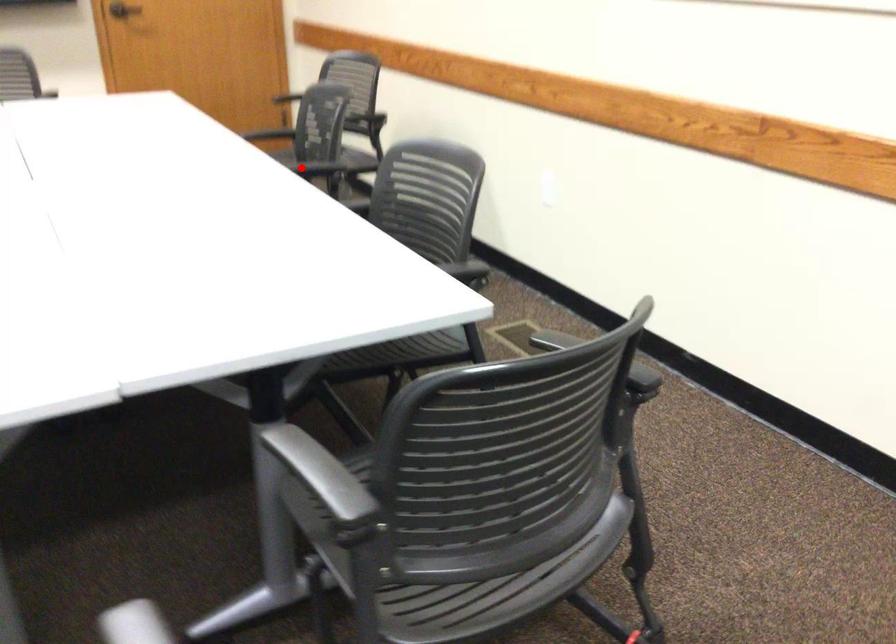
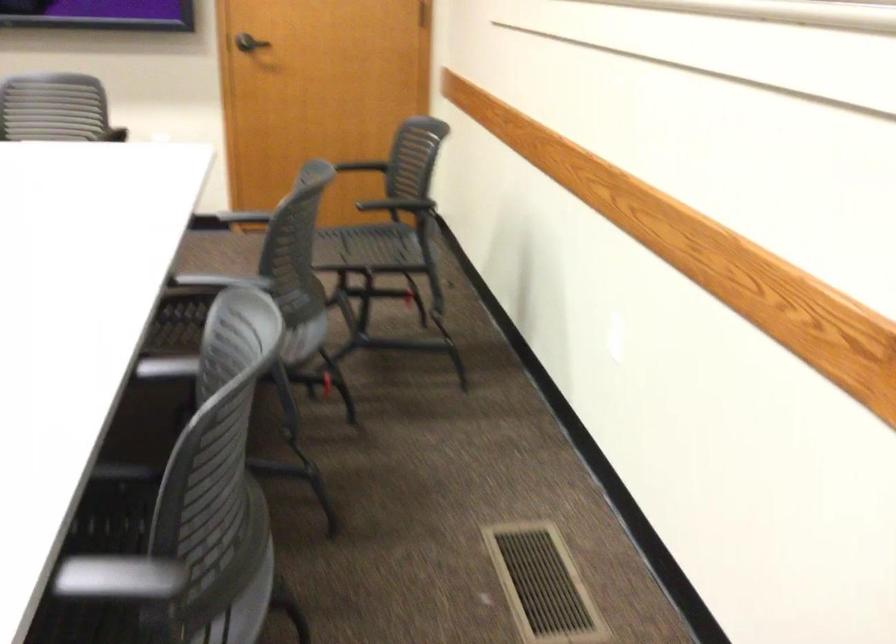
In the second image, find the point that corresponds to the highlighted location in the first image.

(220, 281)